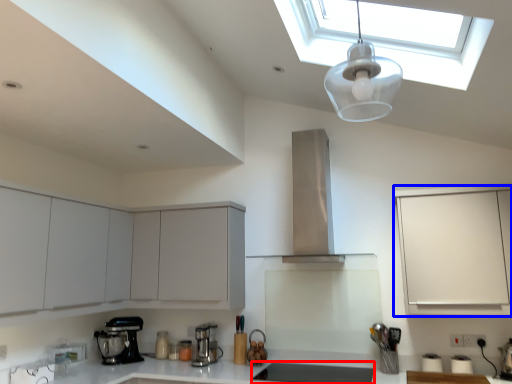
Question: Which of the following is the closest to the observer, appliance (highlighted by a red box) or cabinetry (highlighted by a blue box)?

Choices:
 (A) appliance
 (B) cabinetry

Answer: (B)